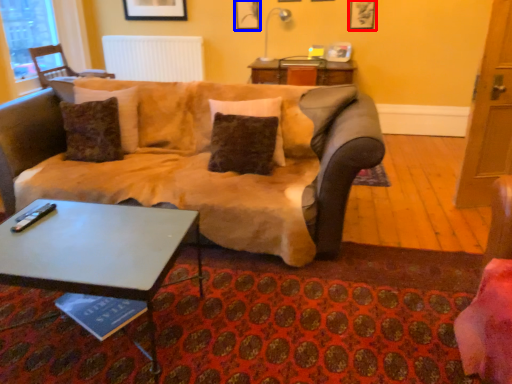
Question: Which of the following is the farthest to the observer, picture frame (highlighted by a red box) or picture frame (highlighted by a blue box)?

Choices:
 (A) picture frame
 (B) picture frame

Answer: (B)